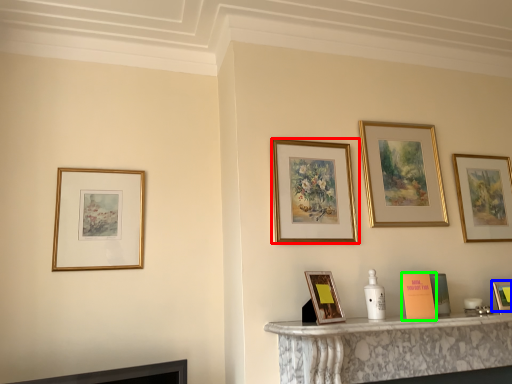
Question: Considering the real-world distances, which object is closest to picture frame (highlighted by a red box)? picture frame (highlighted by a blue box) or book (highlighted by a green box).

Choices:
 (A) picture frame
 (B) book

Answer: (B)